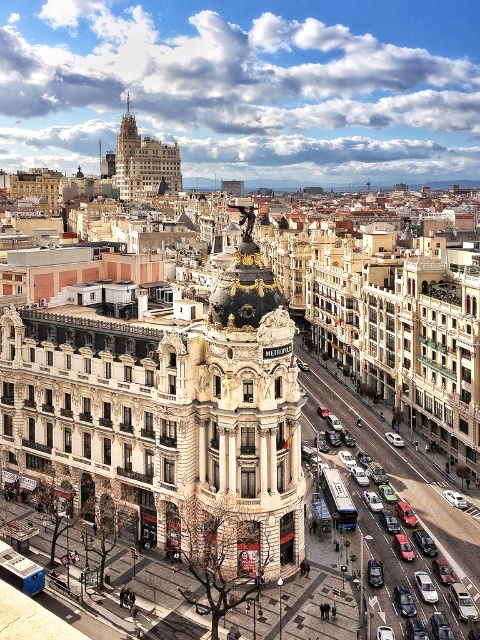
You are standing in the city looking at the Metropolis building. There are two points marked on the image, one at coordinate point [379,531] and another at point [131,115]. Which point is closer to you?

Point [379,531] is closer to you than point [131,115].

Based on the provided scene description, where is the beige stone tower at center located in terms of its 2D coordinates?

The beige stone tower at center is located at the 2D coordinates of point (231, 422).